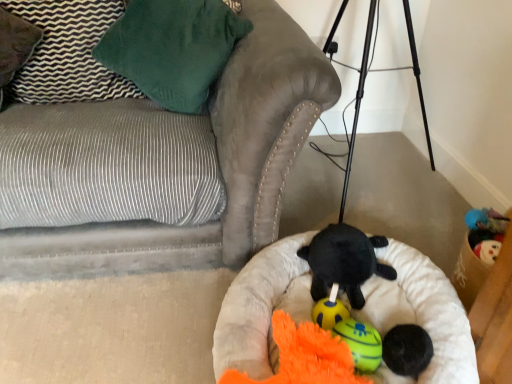
Question: Can you confirm if soft beige dog bed at center is wider than soft black ball at center, the 2th toy when ordered from front to back?

Choices:
 (A) yes
 (B) no

Answer: (A)

Question: Is soft beige dog bed at center turned away from soft black ball at center, the 2th toy when ordered from front to back?

Choices:
 (A) no
 (B) yes

Answer: (A)

Question: From the image's perspective, is soft beige dog bed at center located beneath soft black ball at center, which is the 4th toy from back to front?

Choices:
 (A) yes
 (B) no

Answer: (B)

Question: Can you confirm if soft beige dog bed at center is shorter than soft black ball at center, which is the 4th toy from back to front?

Choices:
 (A) no
 (B) yes

Answer: (A)

Question: Is there a large distance between soft beige dog bed at center and soft black ball at center, which is the 4th toy from back to front?

Choices:
 (A) yes
 (B) no

Answer: (B)

Question: From a real-world perspective, is orange plush toy at center, the 3th toy in the front-to-back sequence, above or below orange fuzzy toy at center, arranged as the 5th toy when viewed from the back?

Choices:
 (A) below
 (B) above

Answer: (A)

Question: Is point (373, 342) closer or farther from the camera than point (286, 314)?

Choices:
 (A) closer
 (B) farther

Answer: (A)

Question: In the image, is orange plush toy at center, placed as the 3th toy when sorted from back to front, positioned in front of or behind orange fuzzy toy at center, arranged as the 5th toy when viewed from the back?

Choices:
 (A) behind
 (B) front

Answer: (A)

Question: From the image's perspective, relative to orange fuzzy toy at center, arranged as the 5th toy when viewed from the back, is orange plush toy at center, the 3th toy in the front-to-back sequence, above or below?

Choices:
 (A) below
 (B) above

Answer: (B)

Question: Is velvet green pillow at upper left, which is the first pillow in left-to-right order, inside the boundaries of black plush turtle at center, positioned as the fourth toy in front-to-back order, or outside?

Choices:
 (A) outside
 (B) inside

Answer: (A)

Question: Would you say velvet green pillow at upper left, which is the first pillow in left-to-right order, is to the left or to the right of black plush turtle at center, positioned as the fourth toy in front-to-back order, in the picture?

Choices:
 (A) right
 (B) left

Answer: (B)

Question: Is velvet green pillow at upper left, placed as the 2th pillow when sorted from right to left, wider or thinner than black plush turtle at center, which is the 2th toy from back to front?

Choices:
 (A) wide
 (B) thin

Answer: (B)

Question: From a real-world perspective, is velvet green pillow at upper left, placed as the 2th pillow when sorted from right to left, positioned above or below black plush turtle at center, positioned as the fourth toy in front-to-back order?

Choices:
 (A) below
 (B) above

Answer: (B)

Question: From the image's perspective, is orange plush toy at center, the 3th toy in the front-to-back sequence, positioned above or below suede gray couch at lower left?

Choices:
 (A) below
 (B) above

Answer: (A)

Question: From a real-world perspective, is orange plush toy at center, placed as the 3th toy when sorted from back to front, positioned above or below suede gray couch at lower left?

Choices:
 (A) above
 (B) below

Answer: (B)